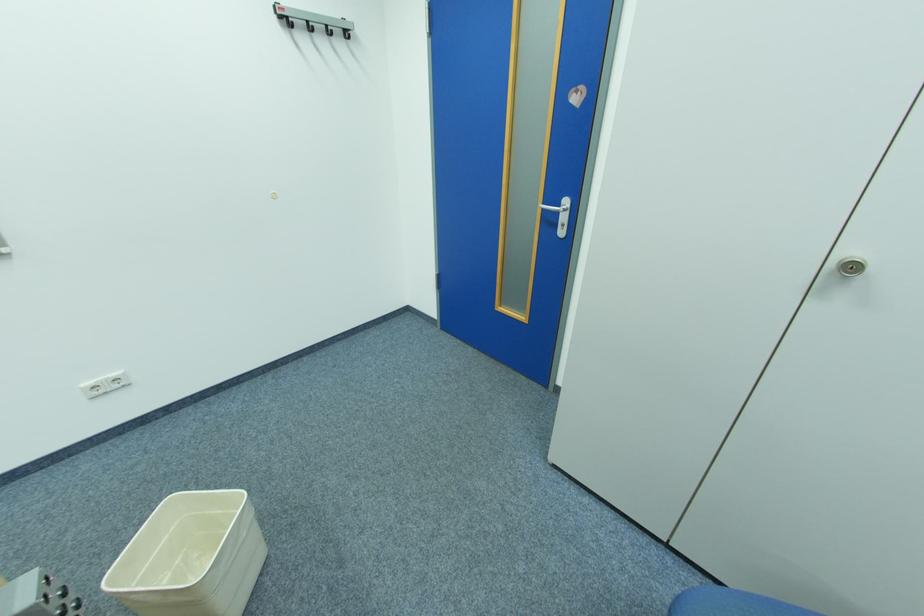
This screenshot has height=616, width=924. What do you see at coordinates (93, 387) in the screenshot? I see `a white power socket` at bounding box center [93, 387].